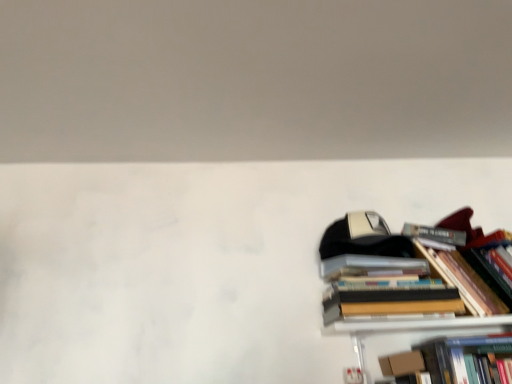
Question: From a real-world perspective, is hardcover book at lower right positioned over hardcover books at right based on gravity?

Choices:
 (A) yes
 (B) no

Answer: (B)

Question: Is hardcover book at lower right shorter than hardcover books at right?

Choices:
 (A) no
 (B) yes

Answer: (B)

Question: Does hardcover book at lower right have a greater width compared to hardcover books at right?

Choices:
 (A) no
 (B) yes

Answer: (A)

Question: Does hardcover book at lower right appear on the left side of hardcover books at right?

Choices:
 (A) yes
 (B) no

Answer: (A)

Question: Is the depth of hardcover book at lower right greater than that of hardcover books at right?

Choices:
 (A) yes
 (B) no

Answer: (A)

Question: Considering the relative sizes of hardcover book at lower right and hardcover books at right in the image provided, is hardcover book at lower right taller than hardcover books at right?

Choices:
 (A) yes
 (B) no

Answer: (B)

Question: Is hardcover books at right bigger than hardcover book at lower right?

Choices:
 (A) no
 (B) yes

Answer: (B)

Question: From the image's perspective, is hardcover books at right beneath hardcover book at lower right?

Choices:
 (A) yes
 (B) no

Answer: (B)

Question: Is hardcover books at right oriented towards hardcover book at lower right?

Choices:
 (A) yes
 (B) no

Answer: (B)

Question: Is hardcover books at right at the left side of hardcover book at lower right?

Choices:
 (A) no
 (B) yes

Answer: (A)

Question: Does hardcover books at right have a lesser height compared to hardcover book at lower right?

Choices:
 (A) yes
 (B) no

Answer: (B)

Question: Does hardcover books at right have a greater height compared to hardcover book at lower right?

Choices:
 (A) yes
 (B) no

Answer: (A)

Question: Is hardcover books at right bigger or smaller than hardcover book at lower right?

Choices:
 (A) small
 (B) big

Answer: (B)